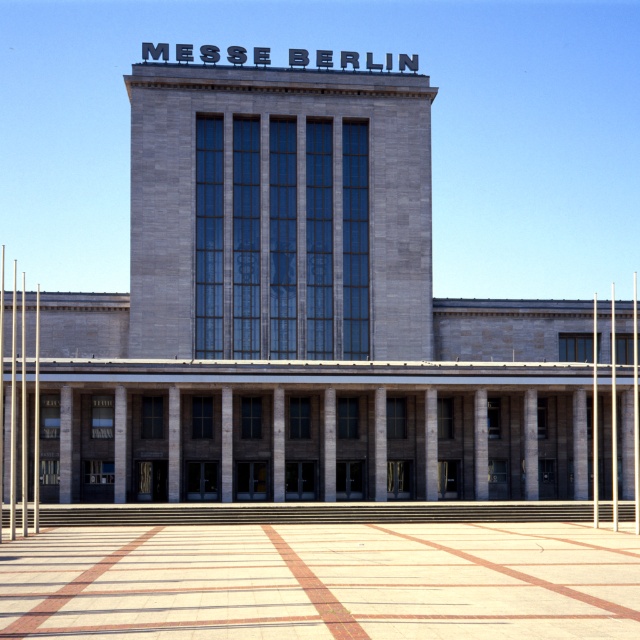
Describe the element at coordinates (636, 410) in the screenshot. I see `metallic flag pole at right` at that location.

Who is shorter, metallic flag pole at right or silver metallic flag pole at right?

With less height is silver metallic flag pole at right.

Locate an element on the screen. metallic flag pole at right is located at coordinates [636, 410].